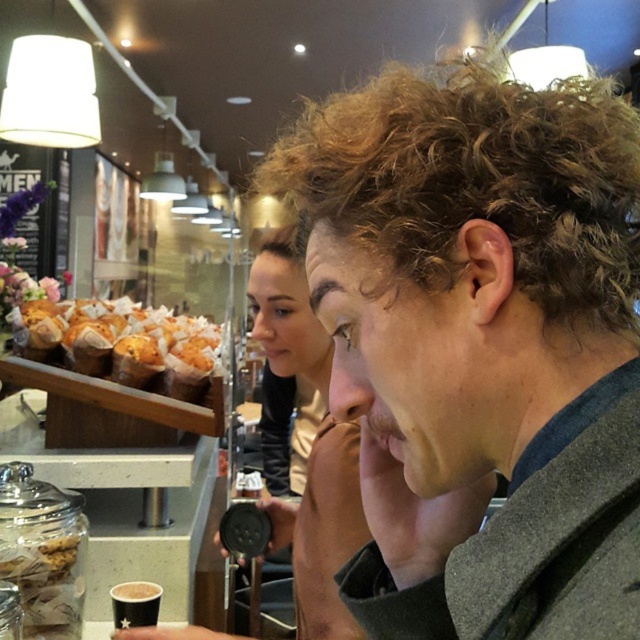
Question: Which point is farther to the camera?

Choices:
 (A) (289, 248)
 (B) (358, 170)

Answer: (A)

Question: Among these points, which one is farthest from the camera?

Choices:
 (A) (248, 284)
 (B) (33, 337)
 (C) (280, 241)
 (D) (534, 355)

Answer: (A)

Question: Which point is farther to the camera?

Choices:
 (A) matte black hair at center
 (B) curly brown hair at center
 (C) golden-brown muffin at left
 (D) brown curly hair at upper center

Answer: (C)

Question: Does matte black hair at center appear under brown curly hair at upper center?

Choices:
 (A) no
 (B) yes

Answer: (B)

Question: Is golden-brown muffin at left above brown curly hair at upper center?

Choices:
 (A) no
 (B) yes

Answer: (A)

Question: Is curly brown hair at center in front of golden-brown muffin at left?

Choices:
 (A) no
 (B) yes

Answer: (B)